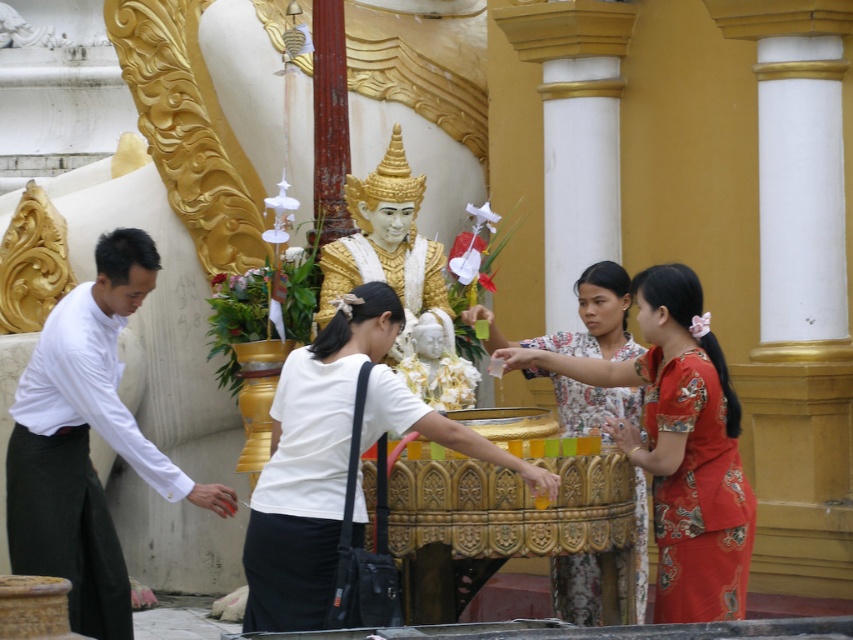
Which is above, white matte shirt at center or printed cotton blouse at center?

white matte shirt at center is above.

Locate an element on the screen. white matte shirt at center is located at coordinates click(310, 465).

Is point (120, 440) farther from camera compared to point (405, 381)?

No, it is not.

The width and height of the screenshot is (853, 640). I want to click on white matte shirt at left, so click(x=86, y=442).

Locate an element on the screen. white matte shirt at left is located at coordinates coord(86,442).

This screenshot has height=640, width=853. Describe the element at coordinates (86, 442) in the screenshot. I see `white matte shirt at left` at that location.

Does white matte shirt at left appear on the right side of silk floral dress at right?

Incorrect, white matte shirt at left is not on the right side of silk floral dress at right.

Find the location of a particular element. The width and height of the screenshot is (853, 640). white matte shirt at left is located at coordinates (86, 442).